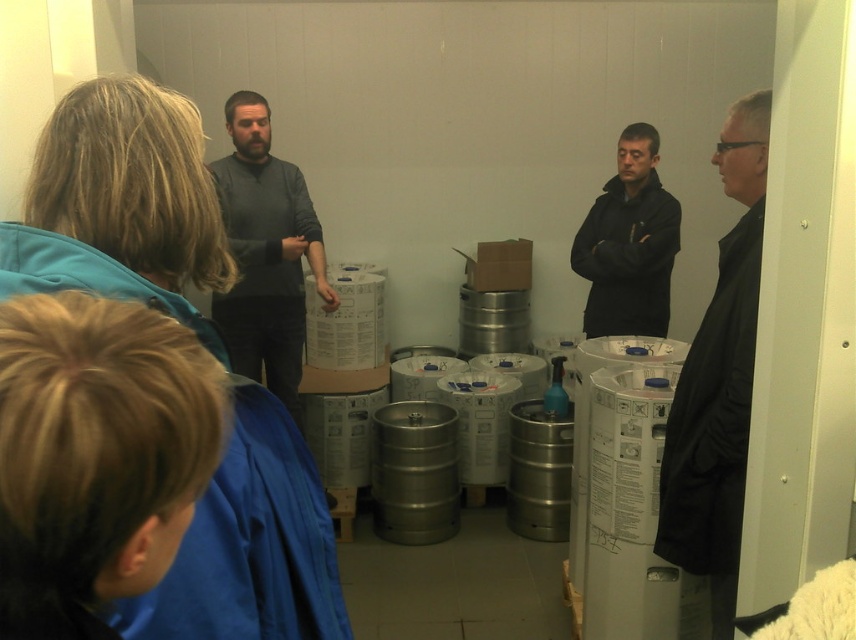
Question: Can you confirm if black matte coat at right is positioned to the right of black matte jacket at center?

Choices:
 (A) yes
 (B) no

Answer: (B)

Question: Can you confirm if dark gray sweater at center is positioned above black matte jacket at center?

Choices:
 (A) no
 (B) yes

Answer: (A)

Question: Which of the following is the closest to the observer?

Choices:
 (A) (595, 292)
 (B) (718, 333)
 (C) (235, 368)

Answer: (B)

Question: Which object is positioned closest to the black matte jacket at center?

Choices:
 (A) dark gray sweater at center
 (B) black matte coat at right

Answer: (A)

Question: Is black matte coat at right positioned behind dark gray sweater at center?

Choices:
 (A) yes
 (B) no

Answer: (B)

Question: Which point is farther from the camera taking this photo?

Choices:
 (A) (626, 193)
 (B) (311, 228)
 (C) (726, 484)

Answer: (A)